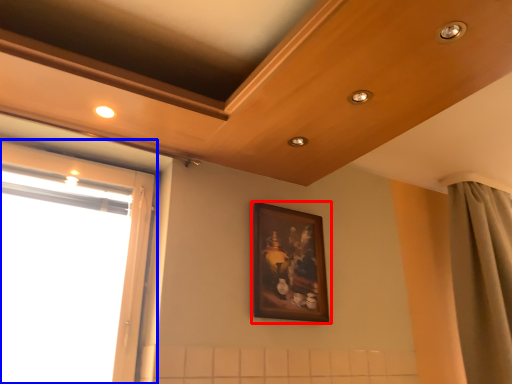
Question: Which of the following is the farthest to the observer, picture frame (highlighted by a red box) or window (highlighted by a blue box)?

Choices:
 (A) picture frame
 (B) window

Answer: (A)